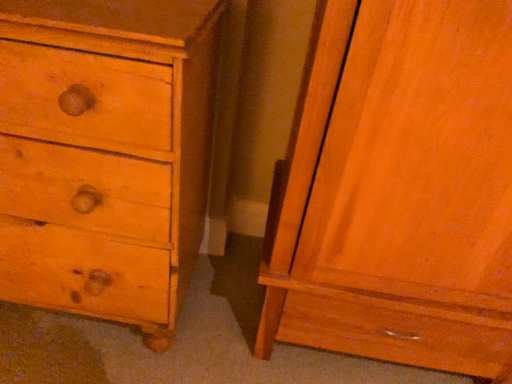
Question: Is there a large distance between matte pine chest of drawers at left and matte wood cabinet at right?

Choices:
 (A) yes
 (B) no

Answer: (B)

Question: Considering the relative positions of matte pine chest of drawers at left and matte wood cabinet at right in the image provided, is matte pine chest of drawers at left to the right of matte wood cabinet at right from the viewer's perspective?

Choices:
 (A) no
 (B) yes

Answer: (A)

Question: From a real-world perspective, is matte pine chest of drawers at left on top of matte wood cabinet at right?

Choices:
 (A) yes
 (B) no

Answer: (B)

Question: From a real-world perspective, is matte pine chest of drawers at left physically below matte wood cabinet at right?

Choices:
 (A) no
 (B) yes

Answer: (B)

Question: Is matte pine chest of drawers at left located outside matte wood cabinet at right?

Choices:
 (A) no
 (B) yes

Answer: (B)

Question: Would you say matte wood cabinet at right is part of matte pine chest of drawers at left's contents?

Choices:
 (A) yes
 (B) no

Answer: (B)

Question: Are matte wood cabinet at right and matte pine chest of drawers at left making contact?

Choices:
 (A) no
 (B) yes

Answer: (A)

Question: Would you say matte wood cabinet at right is a long distance from matte pine chest of drawers at left?

Choices:
 (A) no
 (B) yes

Answer: (A)

Question: Considering the relative positions of matte wood cabinet at right and matte pine chest of drawers at left in the image provided, is matte wood cabinet at right to the right of matte pine chest of drawers at left from the viewer's perspective?

Choices:
 (A) no
 (B) yes

Answer: (B)

Question: Can you confirm if matte wood cabinet at right is bigger than matte pine chest of drawers at left?

Choices:
 (A) yes
 (B) no

Answer: (A)

Question: Considering the relative positions of matte wood cabinet at right and matte pine chest of drawers at left in the image provided, is matte wood cabinet at right behind matte pine chest of drawers at left?

Choices:
 (A) no
 (B) yes

Answer: (A)

Question: Is matte wood cabinet at right positioned beyond the bounds of matte pine chest of drawers at left?

Choices:
 (A) no
 (B) yes

Answer: (B)

Question: Is matte wood cabinet at right wider or thinner than matte pine chest of drawers at left?

Choices:
 (A) thin
 (B) wide

Answer: (B)